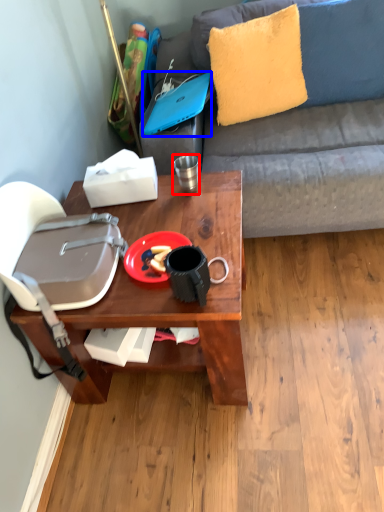
Question: Which point is further to the camera, coffee cup (highlighted by a red box) or laptop (highlighted by a blue box)?

Choices:
 (A) coffee cup
 (B) laptop

Answer: (B)